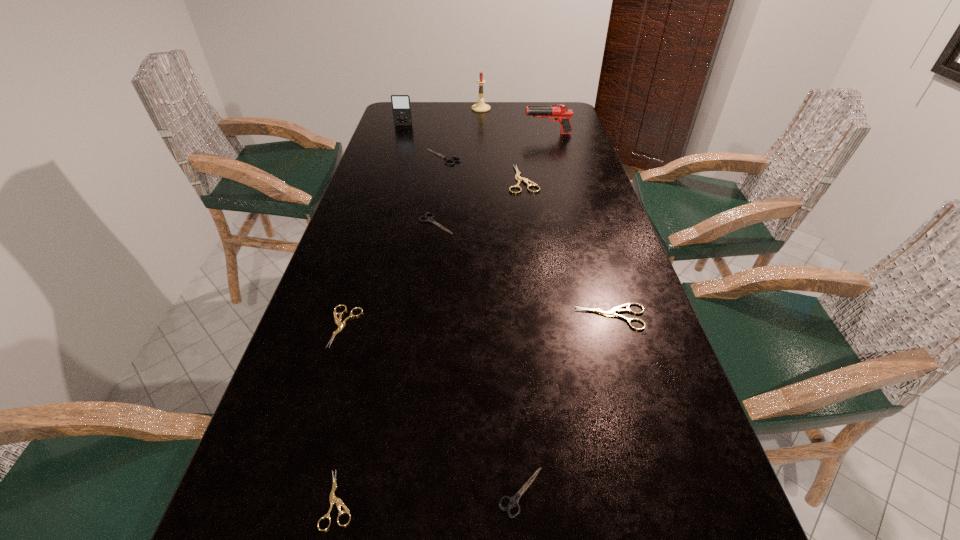
This screenshot has height=540, width=960. I want to click on candle present at the far edge, so click(480, 106).

The width and height of the screenshot is (960, 540). What are the coordinates of `iPod that is at the far edge` in the screenshot? It's located at (401, 107).

Find the location of a particular element. The width and height of the screenshot is (960, 540). iPod at the left edge is located at coordinates (401, 107).

Find the location of `gun that is at the right edge`. gun that is at the right edge is located at coordinates (561, 114).

Locate an element on the screen. This screenshot has width=960, height=540. shears that is at the right edge is located at coordinates (612, 312).

The image size is (960, 540). I want to click on object located at the far left corner, so click(x=401, y=107).

Image resolution: width=960 pixels, height=540 pixels. What are the coordinates of `free space at the far edge of the desktop` in the screenshot? It's located at (452, 107).

Where is `vacant area at the left edge`? This screenshot has width=960, height=540. vacant area at the left edge is located at coordinates (238, 498).

The width and height of the screenshot is (960, 540). In order to click on vacant space at the right edge of the desktop in this screenshot , I will do `click(579, 135)`.

Identify the location of free point between the biggest black shears and the tallest object. The image size is (960, 540). (462, 133).